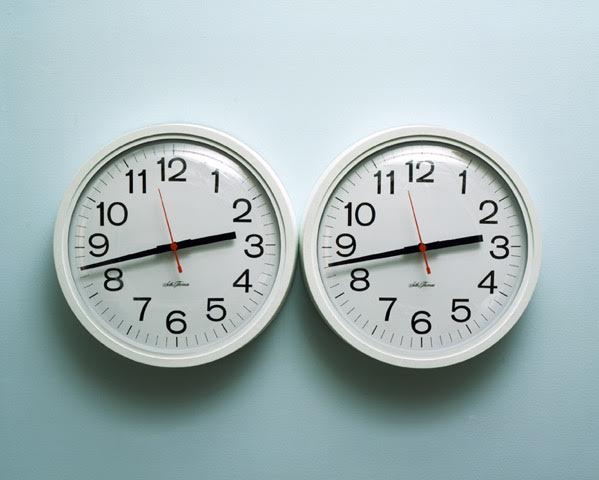
What are the coordinates of `clock rim` in the screenshot? It's located at (167, 130), (416, 136).